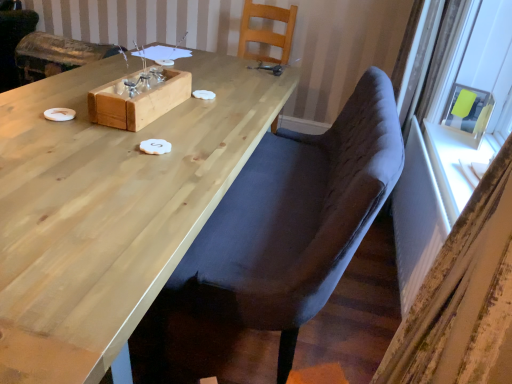
Question: Is wooden box at center bigger than natural wood table at center?

Choices:
 (A) yes
 (B) no

Answer: (B)

Question: Does wooden box at center have a greater height compared to natural wood table at center?

Choices:
 (A) yes
 (B) no

Answer: (B)

Question: Is wooden box at center located outside natural wood table at center?

Choices:
 (A) no
 (B) yes

Answer: (B)

Question: Does wooden box at center come behind natural wood table at center?

Choices:
 (A) no
 (B) yes

Answer: (B)

Question: Considering the relative sizes of wooden box at center and natural wood table at center in the image provided, is wooden box at center wider than natural wood table at center?

Choices:
 (A) no
 (B) yes

Answer: (A)

Question: In the image, is velvet grey chair at center, arranged as the first chair when viewed from the front, on the left side or the right side of wooden chair at upper center, placed as the 2th chair when sorted from front to back?

Choices:
 (A) left
 (B) right

Answer: (B)

Question: From the image's perspective, relative to wooden chair at upper center, arranged as the 1th chair when viewed from the back, is velvet grey chair at center, arranged as the first chair when viewed from the front, above or below?

Choices:
 (A) below
 (B) above

Answer: (A)

Question: Is velvet grey chair at center, the 2th chair from the back, taller or shorter than wooden chair at upper center, placed as the 2th chair when sorted from front to back?

Choices:
 (A) short
 (B) tall

Answer: (B)

Question: From a real-world perspective, relative to wooden chair at upper center, arranged as the 1th chair when viewed from the back, is velvet grey chair at center, arranged as the first chair when viewed from the front, vertically above or below?

Choices:
 (A) above
 (B) below

Answer: (B)

Question: From a real-world perspective, is wooden box at center physically located above or below velvet grey chair at center, the 2th chair from the back?

Choices:
 (A) below
 (B) above

Answer: (B)

Question: Considering the positions of wooden box at center and velvet grey chair at center, arranged as the first chair when viewed from the front, in the image, is wooden box at center taller or shorter than velvet grey chair at center, arranged as the first chair when viewed from the front,?

Choices:
 (A) tall
 (B) short

Answer: (B)

Question: From the image's perspective, is wooden box at center positioned above or below velvet grey chair at center, arranged as the first chair when viewed from the front?

Choices:
 (A) above
 (B) below

Answer: (A)

Question: In the image, is wooden box at center positioned in front of or behind velvet grey chair at center, arranged as the first chair when viewed from the front?

Choices:
 (A) front
 (B) behind

Answer: (B)

Question: Considering the positions of point (285, 364) and point (168, 82), is point (285, 364) closer or farther from the camera than point (168, 82)?

Choices:
 (A) farther
 (B) closer

Answer: (B)

Question: Would you say velvet grey chair at center, the 2th chair from the back, is to the left or to the right of wooden box at center in the picture?

Choices:
 (A) left
 (B) right

Answer: (B)